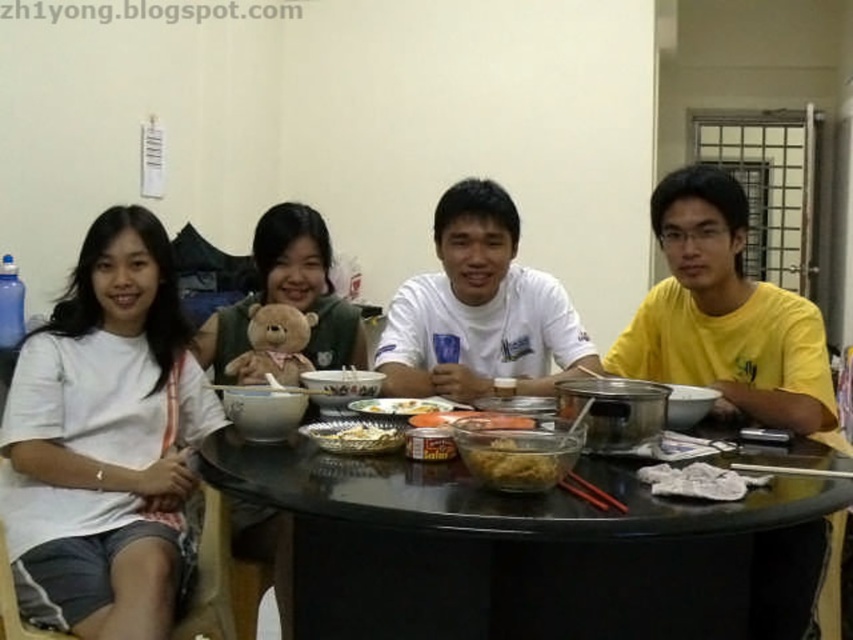
In the scene shown: You are a server at a restaurant and need to place a new dish on the table. The dish is too hot to touch directly. Can you safely place it on the black glossy table at center using the smooth plastic container at center as a heat shield?

The black glossy table at center is positioned under the smooth plastic container at center, so the smooth plastic container at center is above the table. Therefore, you can place the hot dish on the smooth plastic container at center to use it as a heat shield, keeping the black glossy table at center safe from the heat.

You are a guest at this dinner table and want to place your phone on the table. The white matte teddy bear at upper center and the smooth plastic container at center are the only flat surfaces available. Which one should you choose if you want to place a larger phone?

The white matte teddy bear at upper center is bigger than the smooth plastic container at center, so you should choose the white matte teddy bear at upper center to place your larger phone.

You are a photographer trying to capture the group around the round black table. You want to ensure that both the white cotton shirt at left and the white matte teddy bear at upper center are clearly visible in your photo. Which object should you focus on to ensure it doesn t get cropped out?

The white matte teddy bear at upper center should be focused on because it occupies more space and is less likely to be cropped out compared to the white cotton shirt at left which is smaller in size.